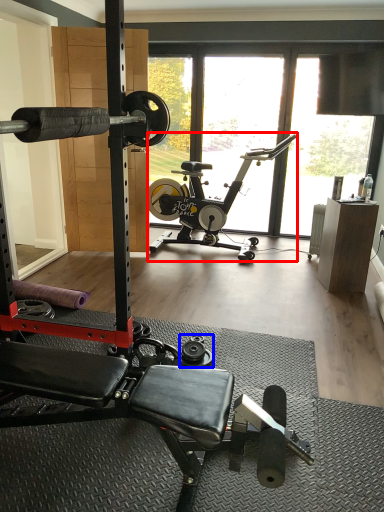
Question: Which point is closer to the camera, stationary bicycle (highlighted by a red box) or dumbbell (highlighted by a blue box)?

Choices:
 (A) stationary bicycle
 (B) dumbbell

Answer: (B)